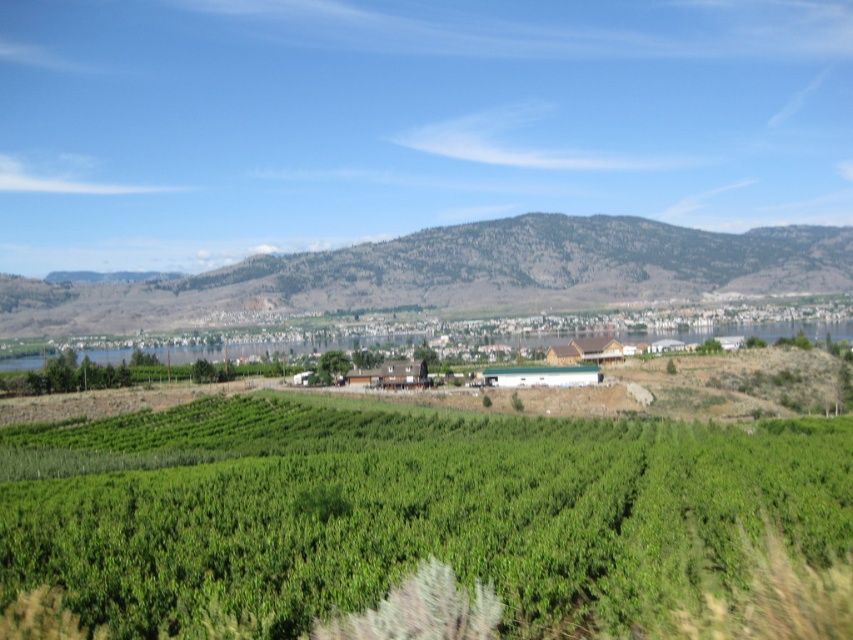
Is point (128, 419) farther from camera compared to point (781, 282)?

No, it is not.

Who is taller, green leafy vineyard at center or rocky gray mountain at center?

rocky gray mountain at center

Does point (57, 584) lie in front of point (389, 289)?

Yes, point (57, 584) is closer to viewer.

I want to click on green leafy vineyard at center, so click(404, 509).